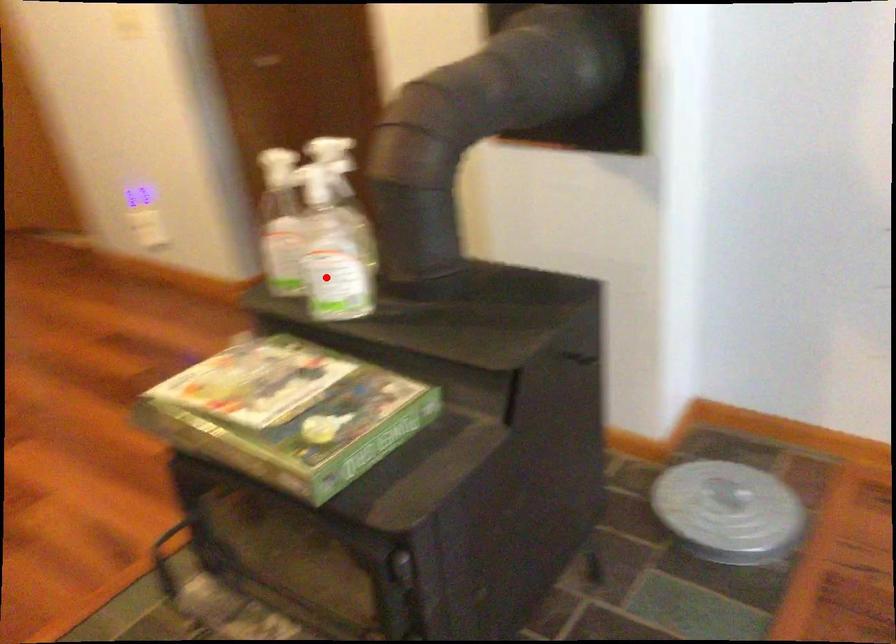
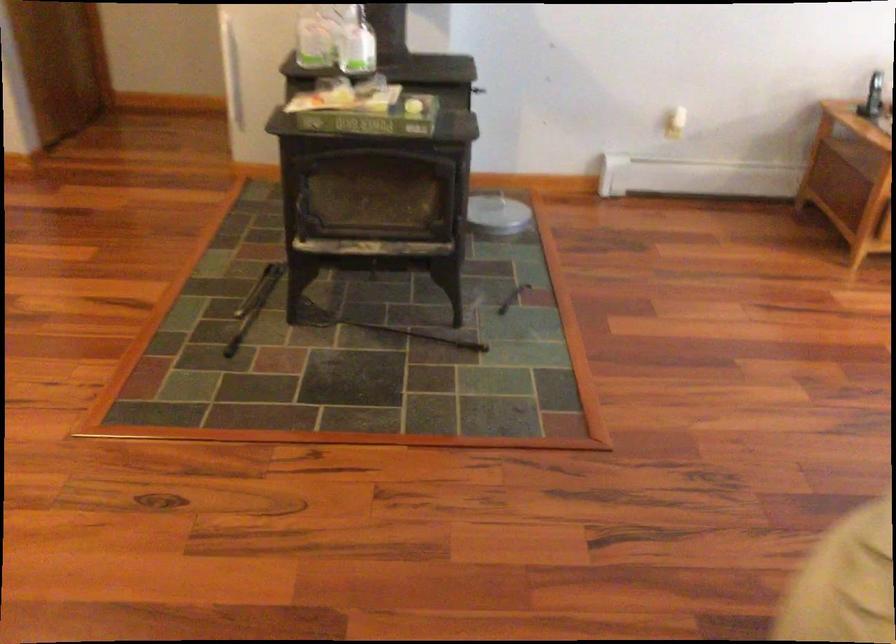
Find the pixel in the second image that matches the highlighted location in the first image.

(357, 46)